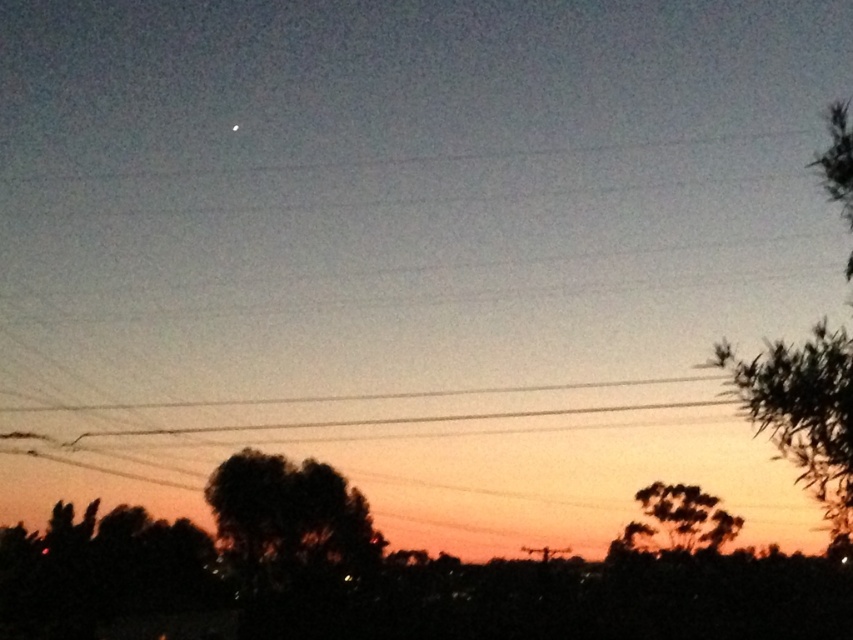
Consider the image. You are standing in the twilight scene and want to walk from the dark green leafy tree at center to the green leafy tree at right. Which direction should you move to reach the wider tree?

The green leafy tree at right is wider than the dark green leafy tree at center, so you should move to the right to reach the wider tree.

You are an artist sketching the twilight scene. You want to ensure the green leafy tree at right and the dark green leafy tree at center are proportionally accurate. Which tree should you draw as bigger in your sketch?

The green leafy tree at right should be drawn as bigger than the dark green leafy tree at center because it is larger in size according to the description.

You are standing in the twilight scene and want to walk towards the green leafy tree at right. Which direction should you head?

Since the green leafy tree at right is positioned at point 0.645 on the x axis and 0.943 on the y axis, you should head towards the right side of the image to reach it.